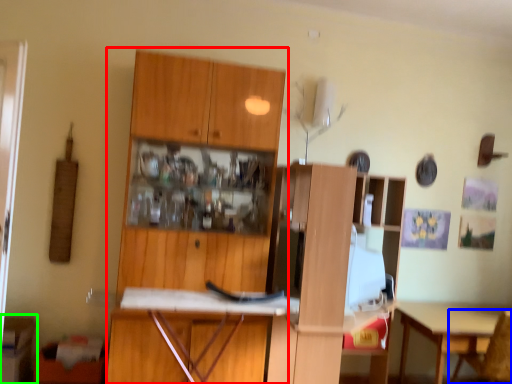
Question: Which is nearer to the cabinetry (highlighted by a red box)? chair (highlighted by a blue box) or cabinetry (highlighted by a green box).

Choices:
 (A) chair
 (B) cabinetry

Answer: (B)